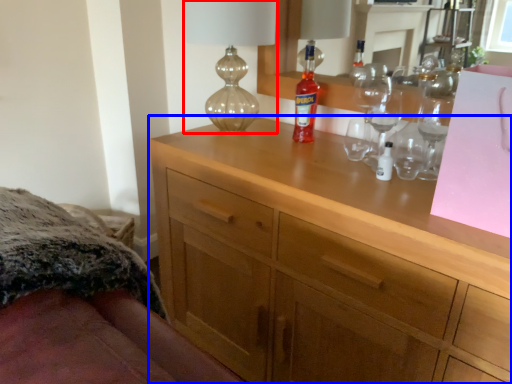
Question: Which point is closer to the camera, table lamp (highlighted by a red box) or chest of drawers (highlighted by a blue box)?

Choices:
 (A) table lamp
 (B) chest of drawers

Answer: (B)